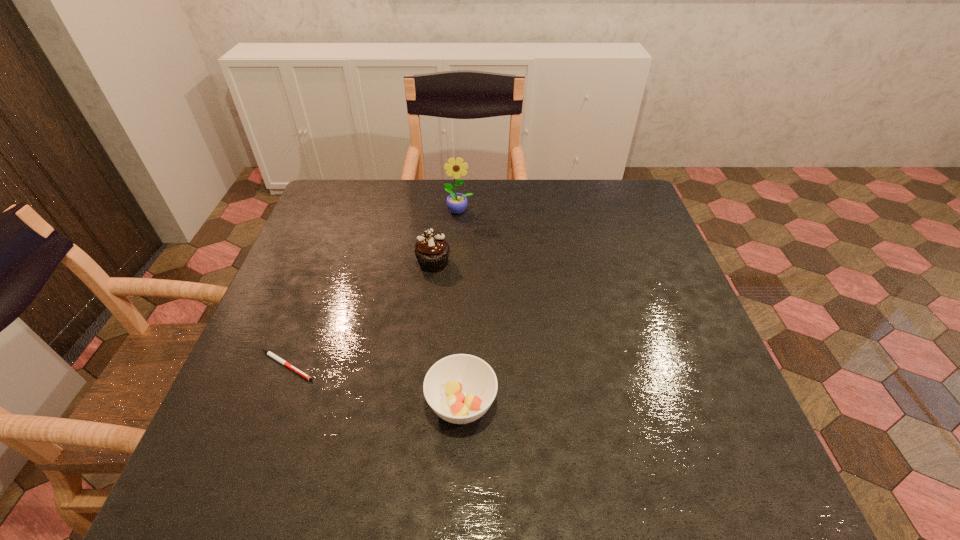
You are a GUI agent. You are given a task and a screenshot of the screen. Output one action in this format:
    pyautogui.click(x=<x>, y=<y>)
    Task: Click on the sunflower
    The image size is (960, 540).
    Given the screenshot: What is the action you would take?
    pyautogui.click(x=456, y=202)

Identify the location of the tallest object. The height and width of the screenshot is (540, 960). (456, 202).

Image resolution: width=960 pixels, height=540 pixels. In order to click on the third nearest object in this screenshot , I will do `click(432, 251)`.

This screenshot has width=960, height=540. I want to click on cupcake, so click(x=432, y=251).

The image size is (960, 540). Identify the location of soup bowl. (460, 388).

Find the location of a particular element. Image resolution: width=960 pixels, height=540 pixels. the shortest object is located at coordinates (280, 360).

Identify the location of pen. The image size is (960, 540). (280, 360).

This screenshot has width=960, height=540. I want to click on free spot located 0.270m on the front-facing side of the sunflower, so click(455, 280).

This screenshot has height=540, width=960. What are the coordinates of `vacant space located 0.060m on the left of the third nearest object` in the screenshot? It's located at (394, 263).

Identify the location of vacant point located 0.360m on the right of the third tallest object. (676, 403).